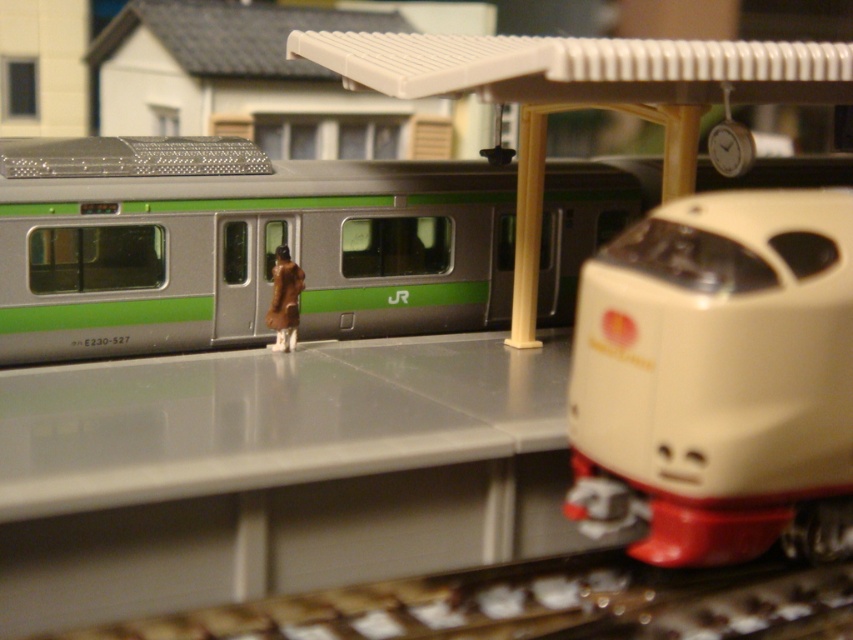
Is metallic silver train at center shorter than brown fur coat at center?

No, metallic silver train at center is not shorter than brown fur coat at center.

Who is lower down, metallic silver train at center or brown fur coat at center?

brown fur coat at center is below.

At what (x,y) coordinates should I click in order to perform the action: click on metallic silver train at center. Please return your answer as a coordinate pair (x, y). The height and width of the screenshot is (640, 853). Looking at the image, I should click on (x=236, y=244).

Where is `beige plastic train at center`? The width and height of the screenshot is (853, 640). beige plastic train at center is located at coordinates (718, 380).

Based on the photo, which of these two, beige plastic train at center or brown fur coat at center, stands taller?

beige plastic train at center is taller.

Which is in front, point (804, 353) or point (276, 342)?

Point (804, 353)

Identify the location of beige plastic train at center. (718, 380).

You are a GUI agent. You are given a task and a screenshot of the screen. Output one action in this format:
    pyautogui.click(x=<x>, y=<y>)
    Task: Click on the metallic silver train at center
    This screenshot has width=853, height=640.
    Given the screenshot: What is the action you would take?
    pyautogui.click(x=236, y=244)

Is point (154, 259) closer to viewer compared to point (711, 432)?

That is False.

Locate an element on the screen. Image resolution: width=853 pixels, height=640 pixels. metallic silver train at center is located at coordinates (236, 244).

Where is `metallic silver train at center`? metallic silver train at center is located at coordinates (236, 244).